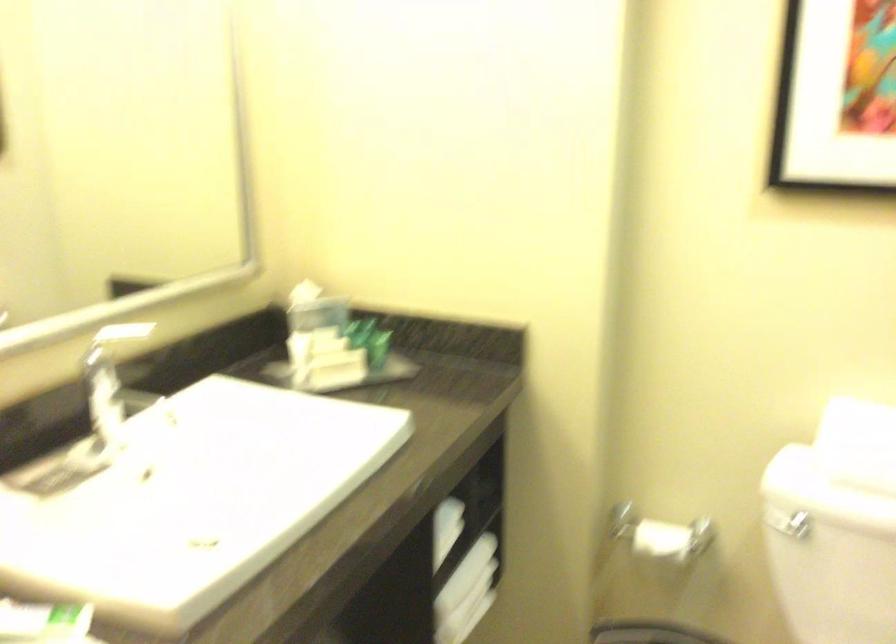
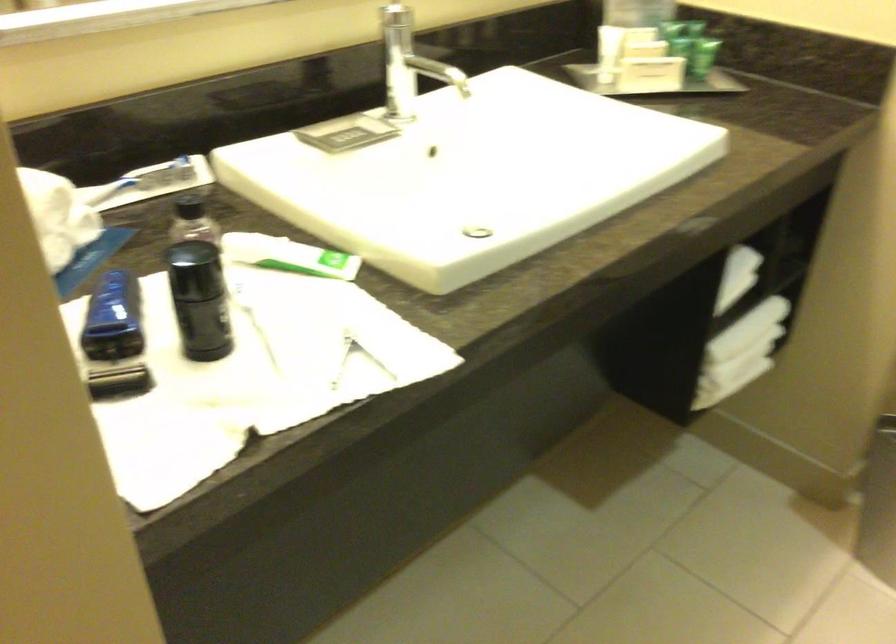
The first image is from the beginning of the video and the second image is from the end. How did the camera likely rotate when shooting the video?

The camera's rotation is toward left-down.